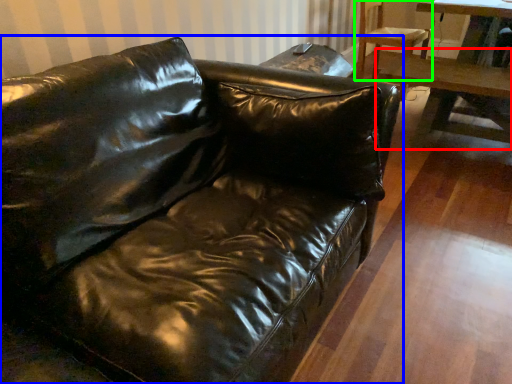
Question: Considering the real-world distances, which object is farthest from table (highlighted by a red box)? studio couch (highlighted by a blue box) or chair (highlighted by a green box)?

Choices:
 (A) studio couch
 (B) chair

Answer: (A)